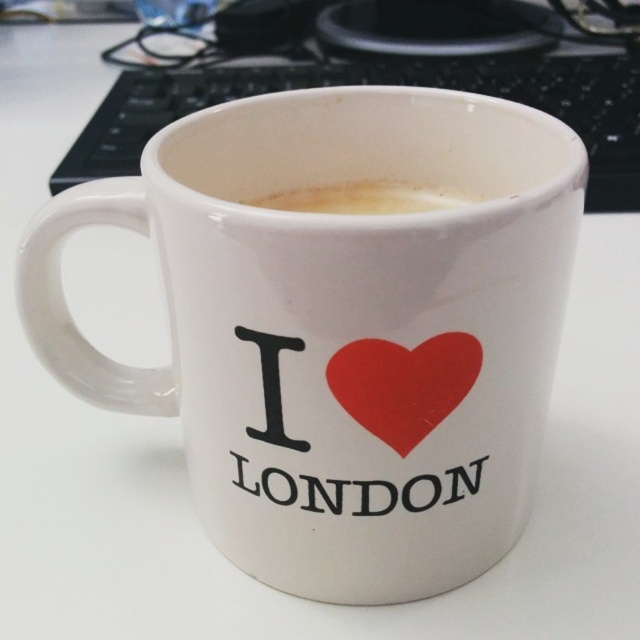
Based on the photo, you are organizing your desk and want to place a new item between the white ceramic mug at center and the black plastic keyboard at upper center. Based on their positions, which object is on the left side where you should start arranging?

The white ceramic mug at center is to the left of the black plastic keyboard at upper center, so you should start arranging near the white ceramic mug at center.

You are setting up a new monitor stand and need to know the exact coordinates of the black plastic keyboard at upper center in the image. What are its coordinates?

The coordinates of the black plastic keyboard at upper center are at point [385,83].